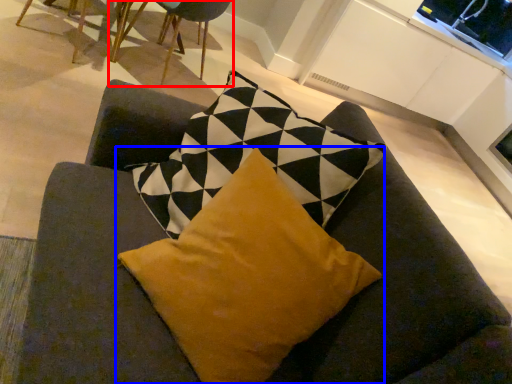
Question: Which of the following is the farthest to the observer, chair (highlighted by a red box) or pillow (highlighted by a blue box)?

Choices:
 (A) chair
 (B) pillow

Answer: (A)